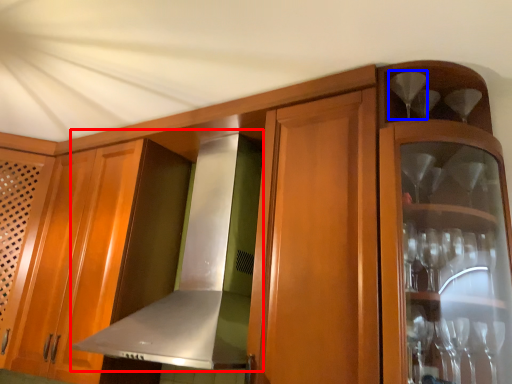
Question: Which object appears closest to the camera in this image, exhaust hood (highlighted by a red box) or wine glass (highlighted by a blue box)?

Choices:
 (A) exhaust hood
 (B) wine glass

Answer: (A)